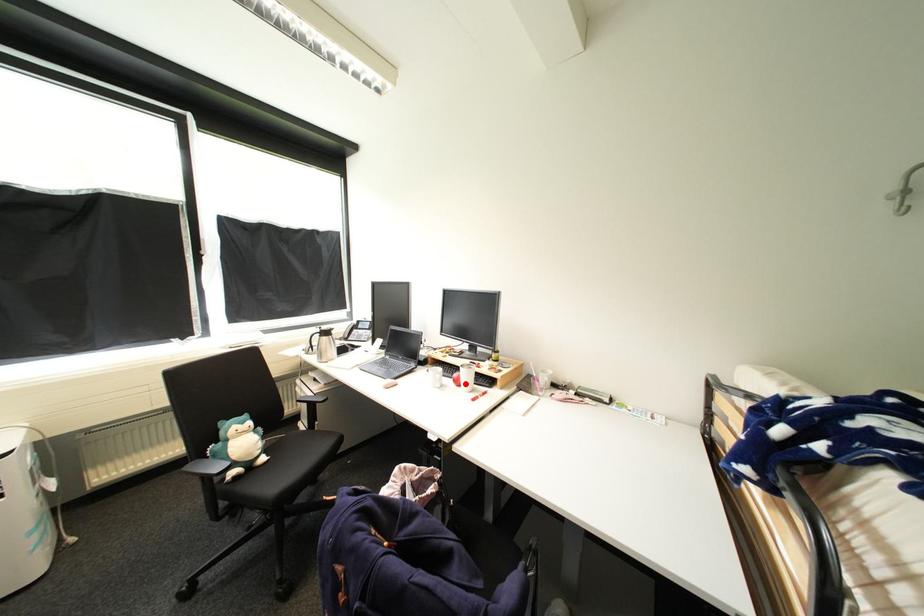
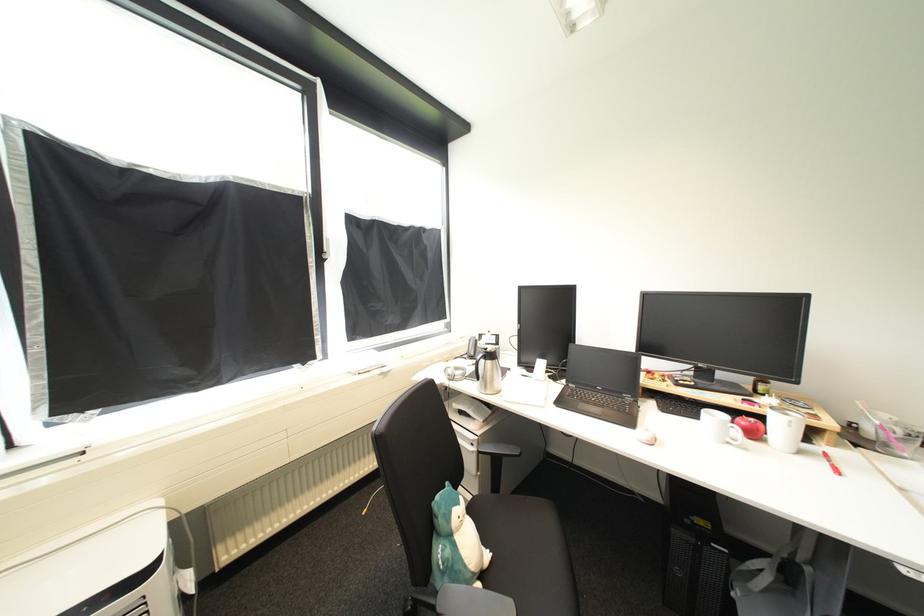
Question: I am providing you with two images of the same scene from different viewpoints. In image1, a red point is highlighted. Considering the same 3D point in image2, which of the following is correct?

Choices:
 (A) It is closer
 (B) It is farther

Answer: (A)